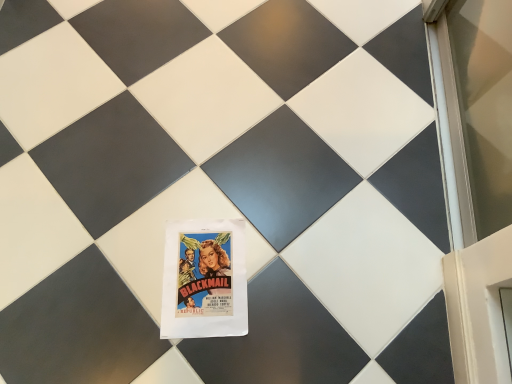
The height and width of the screenshot is (384, 512). In order to click on matte paper poster at center in this screenshot , I will do coord(204,280).

This screenshot has width=512, height=384. Describe the element at coordinates (204, 280) in the screenshot. I see `matte paper poster at center` at that location.

Find the location of a particular element. matte paper poster at center is located at coordinates (204, 280).